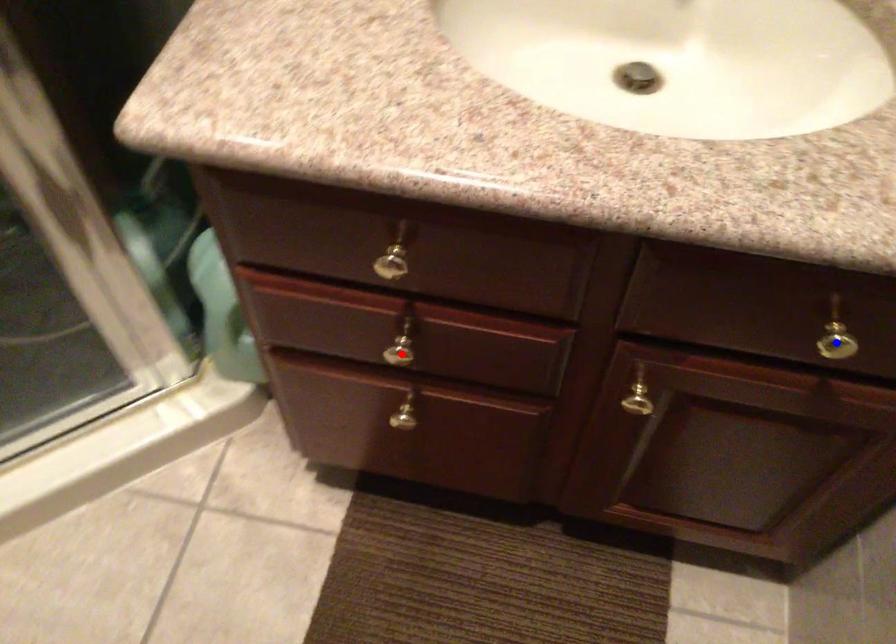
Question: Two points are marked on the image. Which point is closer to the camera?

Choices:
 (A) Blue point is closer.
 (B) Red point is closer.

Answer: (A)